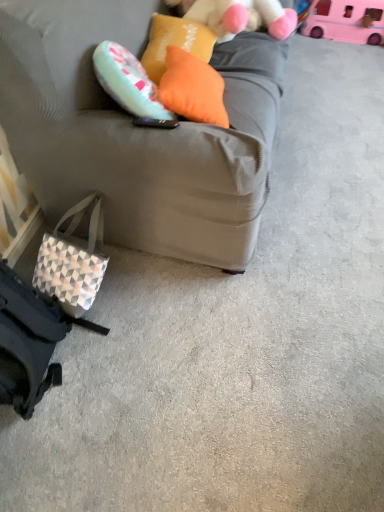
Where is `empty space that is to the right of matte gray couch at center`? Image resolution: width=384 pixels, height=512 pixels. empty space that is to the right of matte gray couch at center is located at coordinates (327, 142).